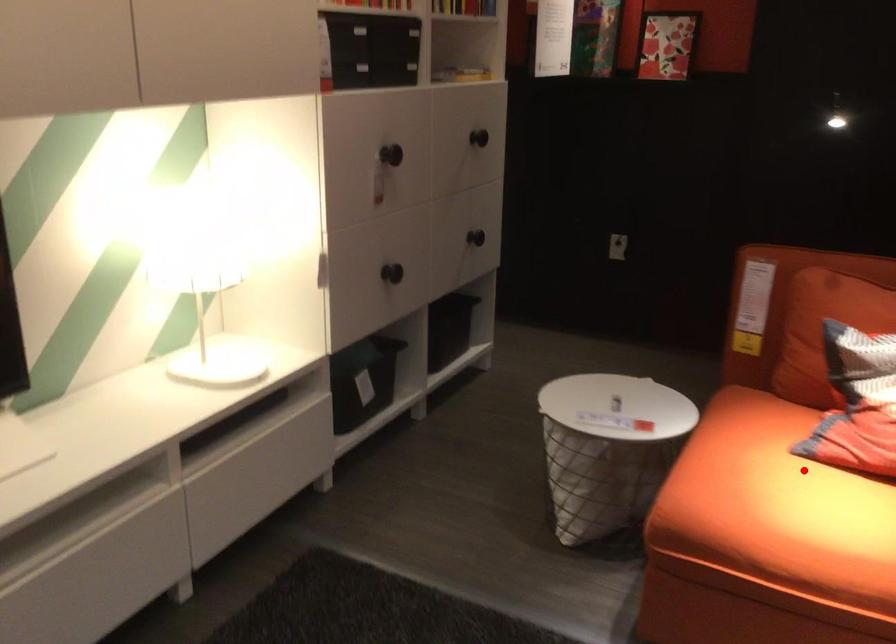
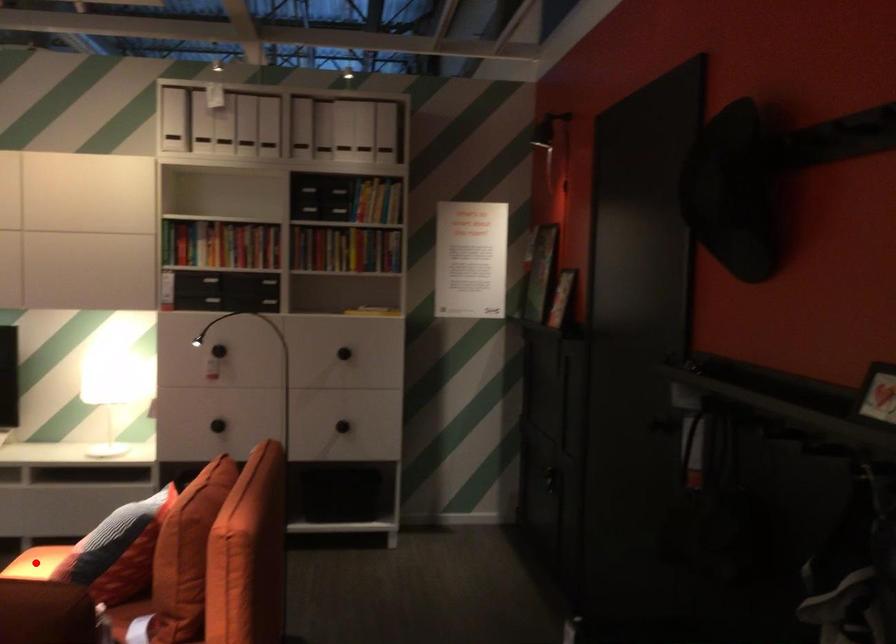
I am providing you with two images of the same scene from different viewpoints. A red point is marked on the first image and another point is marked on the second image. Do the highlighted points in image1 and image2 indicate the same real-world spot?

Yes